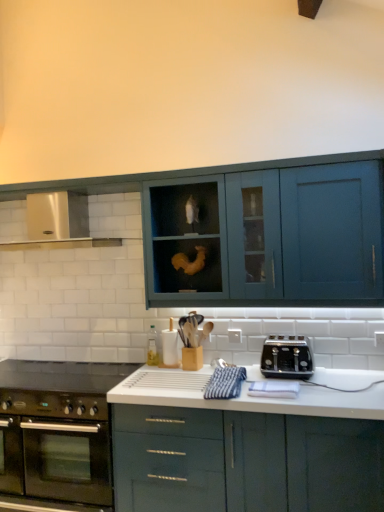
Question: From the image's perspective, is satin silver exhaust hood at upper left located above or below black glass gas stove at lower left?

Choices:
 (A) below
 (B) above

Answer: (B)

Question: From a real-world perspective, is satin silver exhaust hood at upper left above or below black glass gas stove at lower left?

Choices:
 (A) below
 (B) above

Answer: (B)

Question: Estimate the real-world distances between objects in this image. Which object is farther from the black glass gas stove at lower left?

Choices:
 (A) satin silver exhaust hood at upper left
 (B) matte blue cabinet at upper center, which ranks as the 1th cabinetry in top-to-bottom order
 (C) satin silver toaster at right
 (D) white glossy countertop at center, the second cabinetry in the top-to-bottom sequence
 (E) stainless steel oven at lower left

Answer: (C)

Question: Which is nearer to the satin silver exhaust hood at upper left?

Choices:
 (A) satin silver toaster at right
 (B) black glass gas stove at lower left
 (C) stainless steel oven at lower left
 (D) matte blue cabinet at upper center, which appears as the second cabinetry when ordered from the bottom
 (E) white glossy countertop at center, the second cabinetry in the top-to-bottom sequence

Answer: (D)